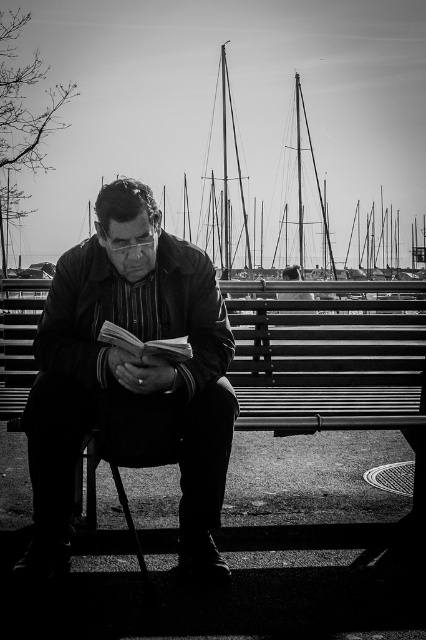
Is matte black jacket at center positioned at the back of thick paper book at center?

That is True.

Can you confirm if matte black jacket at center is positioned to the left of thick paper book at center?

Indeed, matte black jacket at center is positioned on the left side of thick paper book at center.

Which is in front, point (221, 387) or point (178, 342)?

Point (178, 342) is in front.

At what (x,y) coordinates should I click in order to perform the action: click on matte black jacket at center. Please return your answer as a coordinate pair (x, y). The width and height of the screenshot is (426, 640). Looking at the image, I should click on (129, 371).